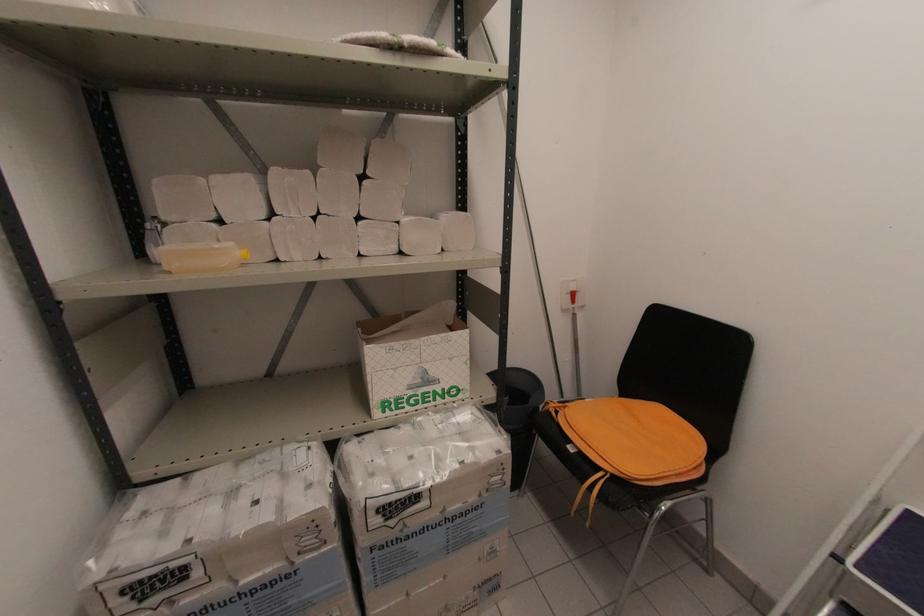
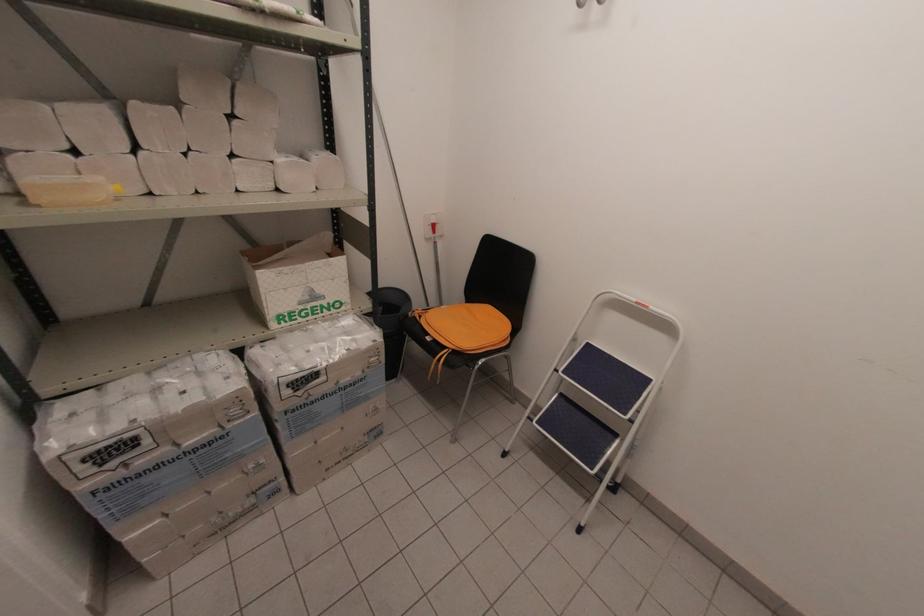
Find the pixel in the second image that matches (x=408, y=539) in the first image.

(312, 403)